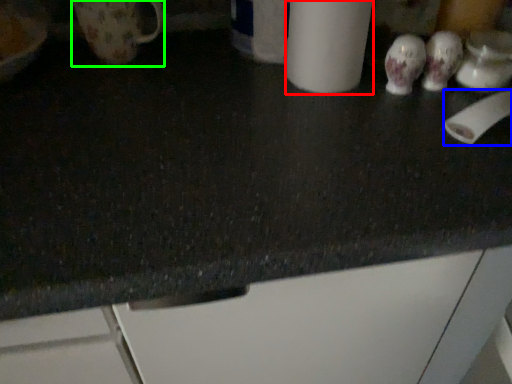
Question: Considering the real-world distances, which object is closest to paper towel (highlighted by a red box)? toilet paper (highlighted by a blue box) or mug (highlighted by a green box).

Choices:
 (A) toilet paper
 (B) mug

Answer: (A)